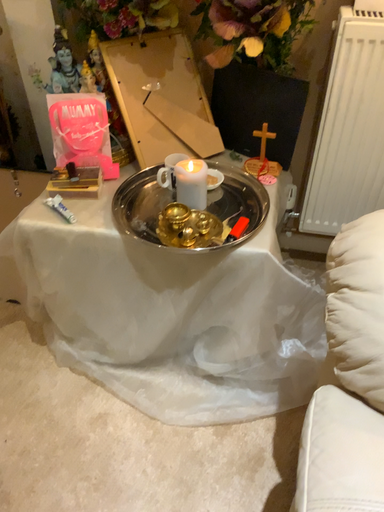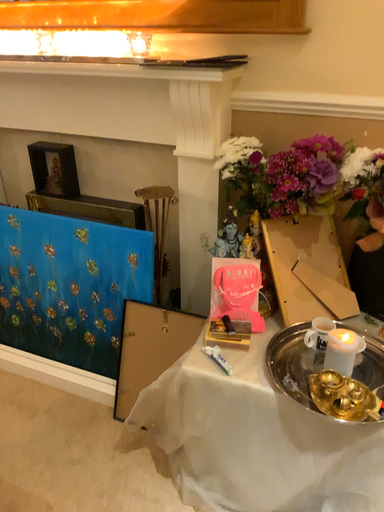
Question: How did the camera likely rotate when shooting the video?

Choices:
 (A) rotated upward
 (B) rotated downward

Answer: (A)